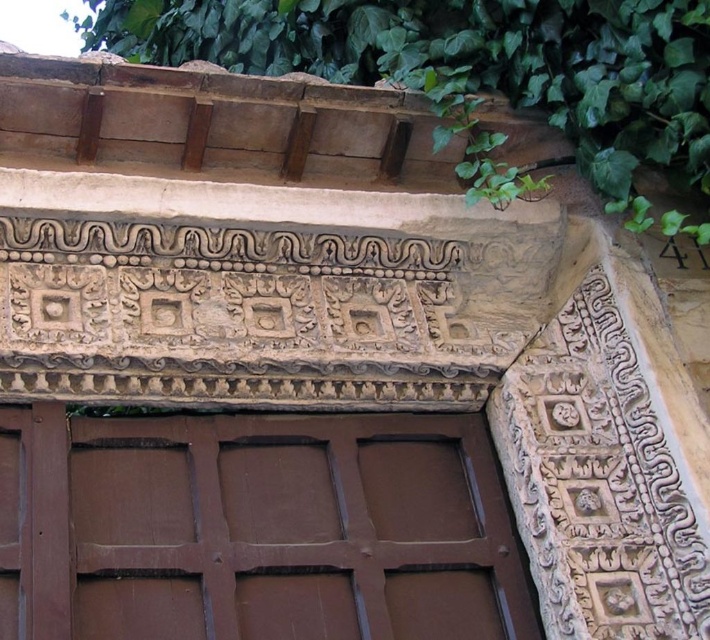
Consider the image. You are an architect examining the historical building. You notice the brown wooden door at center and the green leafy ivy at upper center. Which object takes up more space in the image?

The green leafy ivy at upper center takes up more space in the image than the brown wooden door at center because the brown wooden door at center is smaller than green leafy ivy at upper center.

You are standing in front of a historical building and notice the brown wooden door at center and the green leafy ivy at upper center. Which object is positioned higher up on the structure?

The green leafy ivy at upper center is positioned higher up on the structure than the brown wooden door at center.

You are standing in front of this historical building. You notice a brown wooden door at center and a green leafy ivy at upper center. Which object is positioned to the right of the other?

The brown wooden door at center is to the right of the green leafy ivy at upper center.